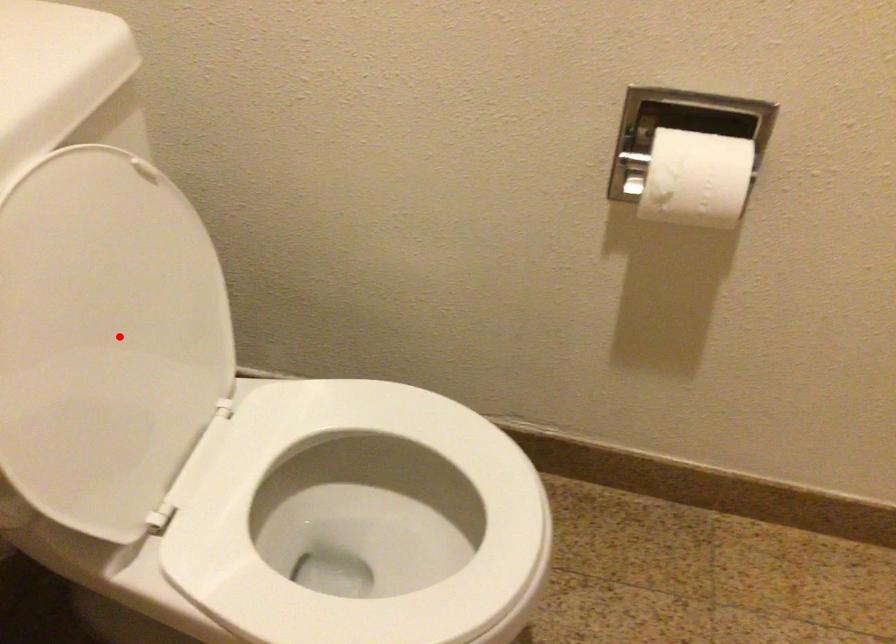
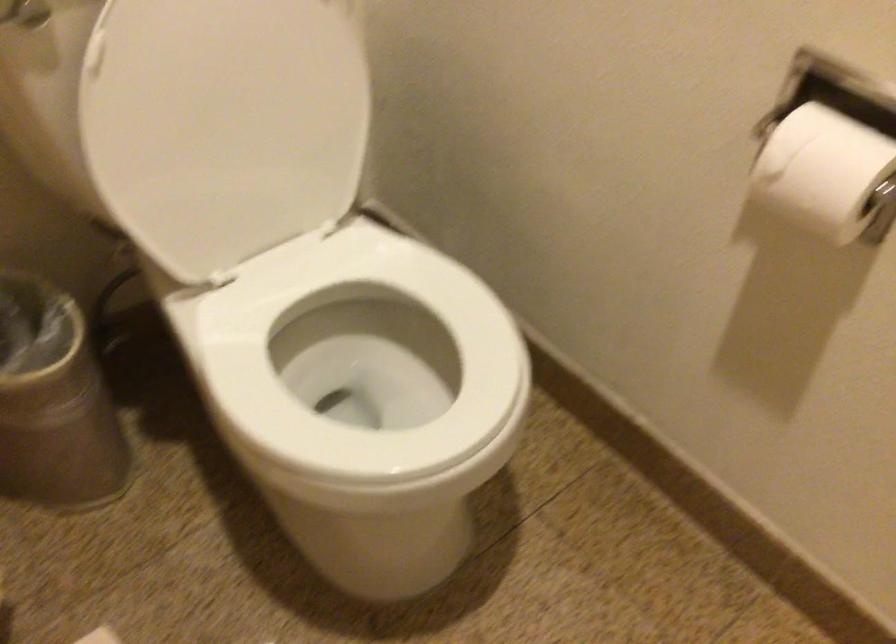
Question: I am providing you with two images of the same scene from different viewpoints. In image1, a red point is highlighted. Considering the same 3D point in image2, which of the following is correct?

Choices:
 (A) It is closer
 (B) It is farther

Answer: (B)